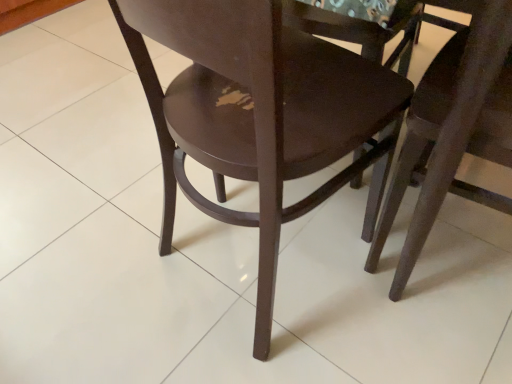
Question: Based on their sizes in the image, would you say glossy wood chair at center, placed as the 1th chair when sorted from left to right, is bigger or smaller than dark wood chair at center, positioned as the second chair in left-to-right order?

Choices:
 (A) big
 (B) small

Answer: (A)

Question: Looking at their shapes, would you say glossy wood chair at center, marked as the 2th chair in a right-to-left arrangement, is wider or thinner than dark wood chair at center, positioned as the second chair in left-to-right order?

Choices:
 (A) wide
 (B) thin

Answer: (A)

Question: Considering their positions, is glossy wood chair at center, placed as the 1th chair when sorted from left to right, located in front of or behind dark wood chair at center, positioned as the second chair in left-to-right order?

Choices:
 (A) behind
 (B) front

Answer: (B)

Question: From the image's perspective, is dark wood chair at center, positioned as the 1th chair in right-to-left order, above or below glossy wood chair at center, placed as the 1th chair when sorted from left to right?

Choices:
 (A) below
 (B) above

Answer: (A)

Question: Considering the positions of dark wood chair at center, positioned as the 1th chair in right-to-left order, and glossy wood chair at center, marked as the 2th chair in a right-to-left arrangement, in the image, is dark wood chair at center, positioned as the 1th chair in right-to-left order, wider or thinner than glossy wood chair at center, marked as the 2th chair in a right-to-left arrangement,?

Choices:
 (A) thin
 (B) wide

Answer: (A)

Question: Is dark wood chair at center, positioned as the second chair in left-to-right order, to the left or to the right of glossy wood chair at center, marked as the 2th chair in a right-to-left arrangement, in the image?

Choices:
 (A) right
 (B) left

Answer: (A)

Question: Considering the positions of point (432, 76) and point (275, 1), is point (432, 76) closer or farther from the camera than point (275, 1)?

Choices:
 (A) closer
 (B) farther

Answer: (B)